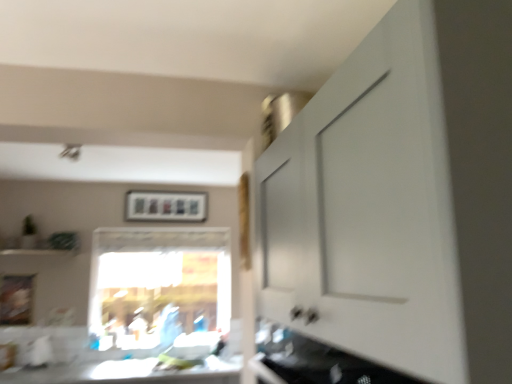
Question: Is wooden picture frame at lower left, marked as the first picture frame in a left-to-right arrangement, thinner than white glossy countertop at lower center?

Choices:
 (A) no
 (B) yes

Answer: (B)

Question: From the image's perspective, is wooden picture frame at lower left, positioned as the 2th picture frame in top-to-bottom order, on top of white glossy countertop at lower center?

Choices:
 (A) yes
 (B) no

Answer: (A)

Question: Can you see wooden picture frame at lower left, marked as the first picture frame in a left-to-right arrangement, touching white glossy countertop at lower center?

Choices:
 (A) yes
 (B) no

Answer: (B)

Question: From a real-world perspective, is wooden picture frame at lower left, arranged as the 1th picture frame when ordered from the bottom, physically below white glossy countertop at lower center?

Choices:
 (A) no
 (B) yes

Answer: (A)

Question: Is wooden picture frame at lower left, the 1th picture frame viewed from the front, looking in the opposite direction of white glossy countertop at lower center?

Choices:
 (A) no
 (B) yes

Answer: (A)

Question: Is wooden picture frame at lower left, arranged as the 1th picture frame when ordered from the bottom, surrounding white glossy countertop at lower center?

Choices:
 (A) no
 (B) yes

Answer: (A)

Question: Is matte plastic picture frame at upper center, the first picture frame when ordered from back to front, aimed at transparent glass window at center?

Choices:
 (A) yes
 (B) no

Answer: (B)

Question: Considering the relative sizes of matte plastic picture frame at upper center, the first picture frame when ordered from back to front, and transparent glass window at center in the image provided, is matte plastic picture frame at upper center, the first picture frame when ordered from back to front, taller than transparent glass window at center?

Choices:
 (A) no
 (B) yes

Answer: (A)

Question: Is the depth of matte plastic picture frame at upper center, the 2th picture frame positioned from the left, less than that of transparent glass window at center?

Choices:
 (A) no
 (B) yes

Answer: (A)

Question: From a real-world perspective, is matte plastic picture frame at upper center, the 2th picture frame positioned from the left, on top of transparent glass window at center?

Choices:
 (A) no
 (B) yes

Answer: (B)

Question: Considering the relative sizes of matte plastic picture frame at upper center, the first picture frame when ordered from back to front, and transparent glass window at center in the image provided, is matte plastic picture frame at upper center, the first picture frame when ordered from back to front, thinner than transparent glass window at center?

Choices:
 (A) no
 (B) yes

Answer: (B)

Question: Is there a large distance between matte plastic picture frame at upper center, which is the first picture frame from top to bottom, and transparent glass window at center?

Choices:
 (A) no
 (B) yes

Answer: (A)

Question: Does transparent glass window at center have a lesser height compared to white glossy countertop at lower center?

Choices:
 (A) yes
 (B) no

Answer: (B)